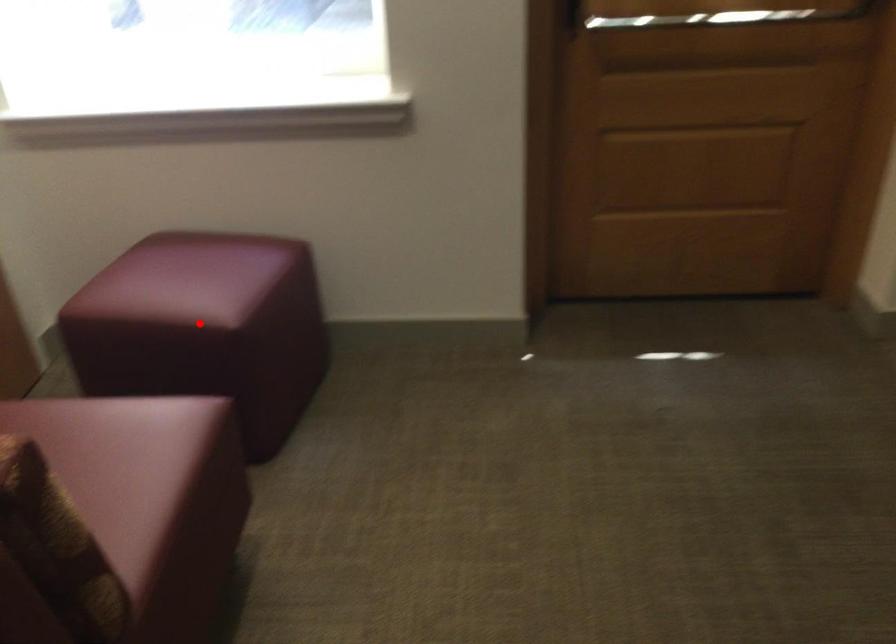
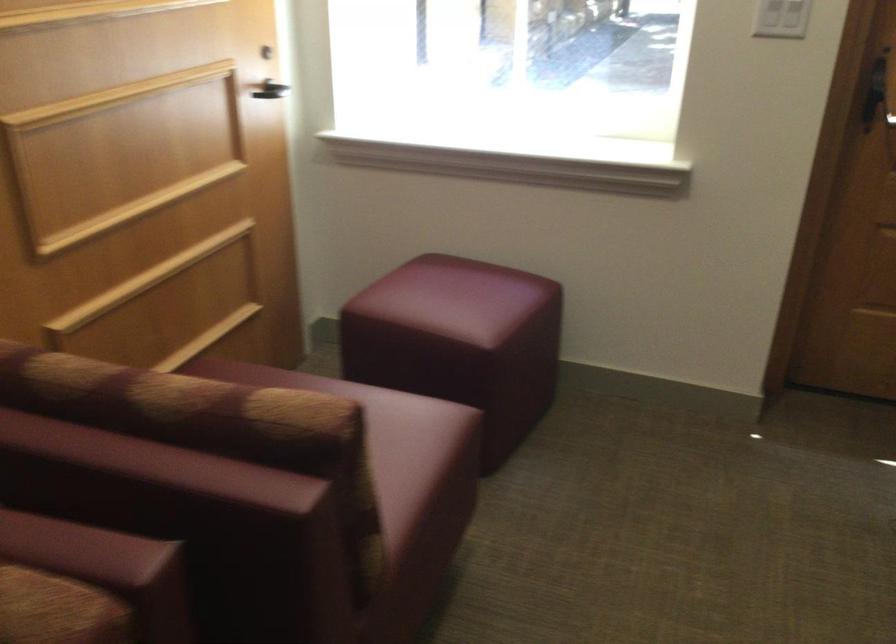
Locate, in the second image, the point that corresponds to the highlighted location in the first image.

(460, 342)